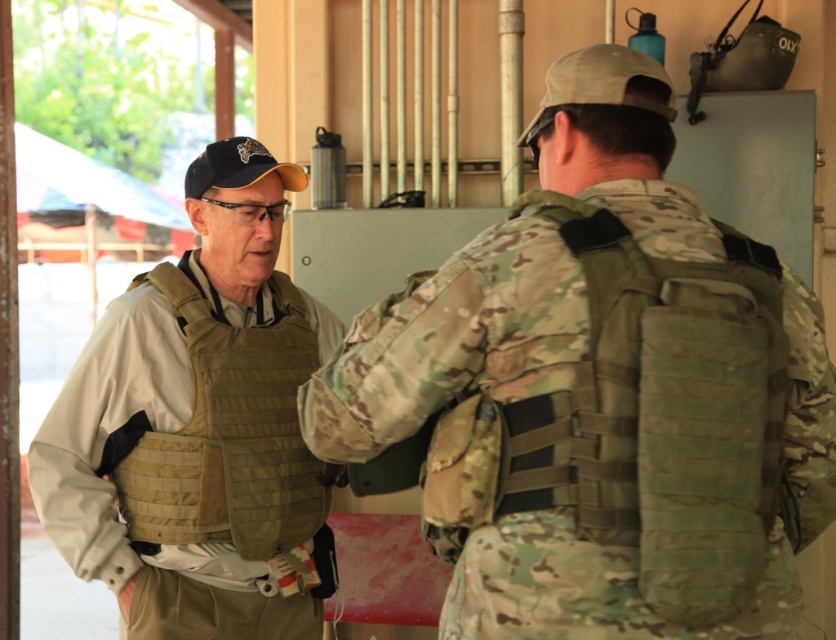
In the scene shown: You are a photographer trying to capture a closeup of the tan fabric vest at left. Given that the camera is focused on the point at coordinates point (x=199, y=428), will the vest be in focus?

The tan fabric vest at left is represented by point (x=199, y=428), so yes, the vest will be in focus since the camera is focused on that exact point.

You are a military medic who needs to quickly access the first aid kit. You see the camouflage fabric vest at center and the tan fabric vest at left. Which vest should you approach to retrieve the first aid kit if it is stored on the vest that is closer to you?

The camouflage fabric vest at center is in front of the tan fabric vest at left, so you should approach the camouflage fabric vest at center to retrieve the first aid kit since it is closer to you.